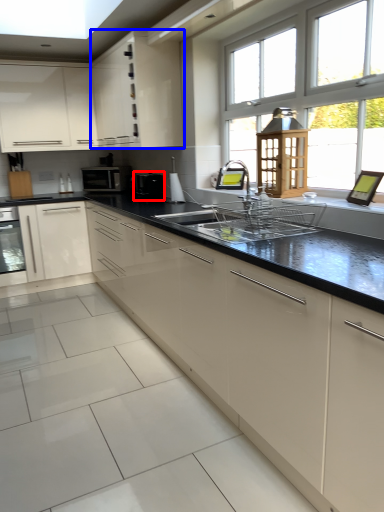
Question: Which of the following is the closest to the observer, appliance (highlighted by a red box) or cabinetry (highlighted by a blue box)?

Choices:
 (A) appliance
 (B) cabinetry

Answer: (B)